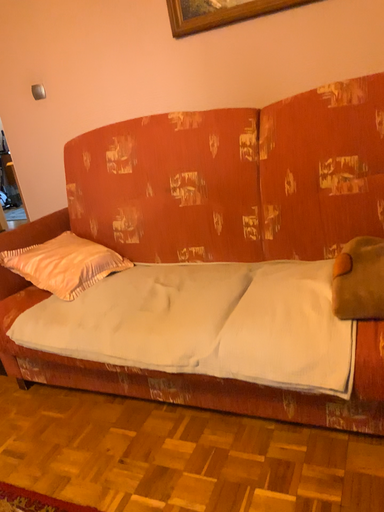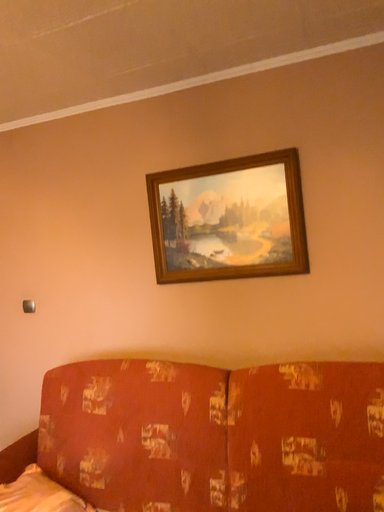
Question: How did the camera likely rotate when shooting the video?

Choices:
 (A) rotated upward
 (B) rotated downward

Answer: (A)